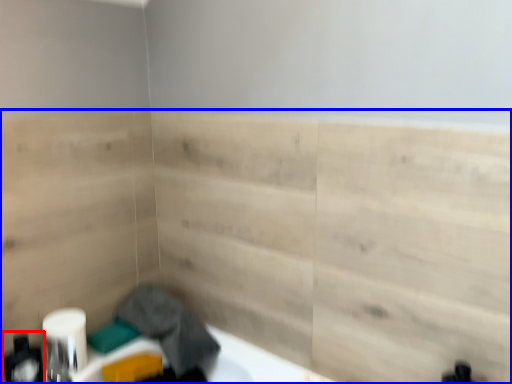
Question: Among these objects, which one is farthest to the camera, toiletry (highlighted by a red box) or plywood (highlighted by a blue box)?

Choices:
 (A) toiletry
 (B) plywood

Answer: (A)